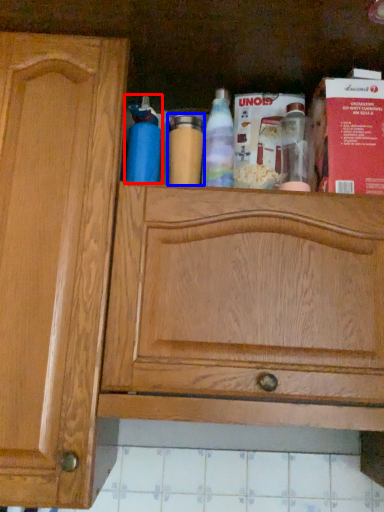
Question: Which of the following is the farthest to the observer, bottle (highlighted by a red box) or bottle (highlighted by a blue box)?

Choices:
 (A) bottle
 (B) bottle

Answer: (B)